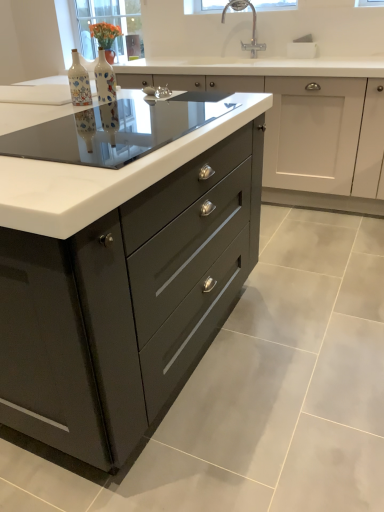
Question: Considering the relative positions of matte ceramic vase at center, arranged as the 2th bottle when viewed from the left, and glossy dark gray cabinet at center, marked as the second cabinetry in a back-to-front arrangement, in the image provided, is matte ceramic vase at center, arranged as the 2th bottle when viewed from the left, to the left or to the right of glossy dark gray cabinet at center, marked as the second cabinetry in a back-to-front arrangement,?

Choices:
 (A) left
 (B) right

Answer: (B)

Question: From a real-world perspective, is matte ceramic vase at center, which is the 1th bottle in right-to-left order, physically located above or below glossy dark gray cabinet at center, the first cabinetry viewed from the front?

Choices:
 (A) below
 (B) above

Answer: (B)

Question: Estimate the real-world distances between objects in this image. Which object is closer to the clear glass window screen at upper center, the 1th window screen viewed from the front?

Choices:
 (A) matte ceramic vase at center, which is the 1th bottle in right-to-left order
 (B) matte glass vase at upper left, which is the second window screen in front-to-back order
 (C) matte black drawers at center, the first cabinetry viewed from the back
 (D) decorative ceramic bottle at center, the 2th bottle viewed from the right
 (E) glossy dark gray cabinet at center, the first cabinetry viewed from the front

Answer: (B)

Question: Estimate the real-world distances between objects in this image. Which object is farther from the matte ceramic vase at center, arranged as the 2th bottle when viewed from the left?

Choices:
 (A) transparent glass table at center
 (B) decorative ceramic bottle at center, the 2th bottle viewed from the right
 (C) glossy dark gray cabinet at center, marked as the second cabinetry in a back-to-front arrangement
 (D) matte black drawers at center, which appears as the 2th cabinetry when viewed from the front
 (E) matte glass vase at upper left, which is the second window screen in front-to-back order

Answer: (E)